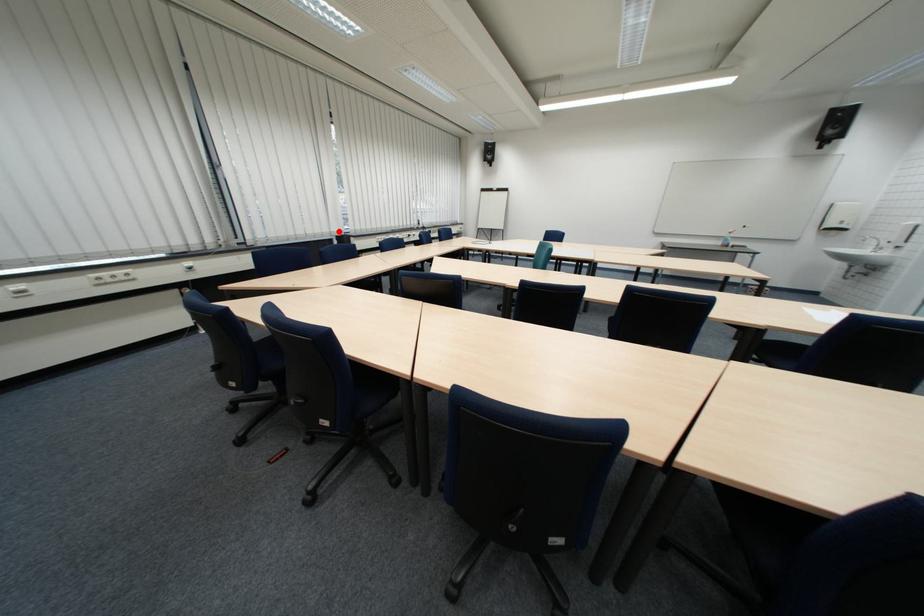
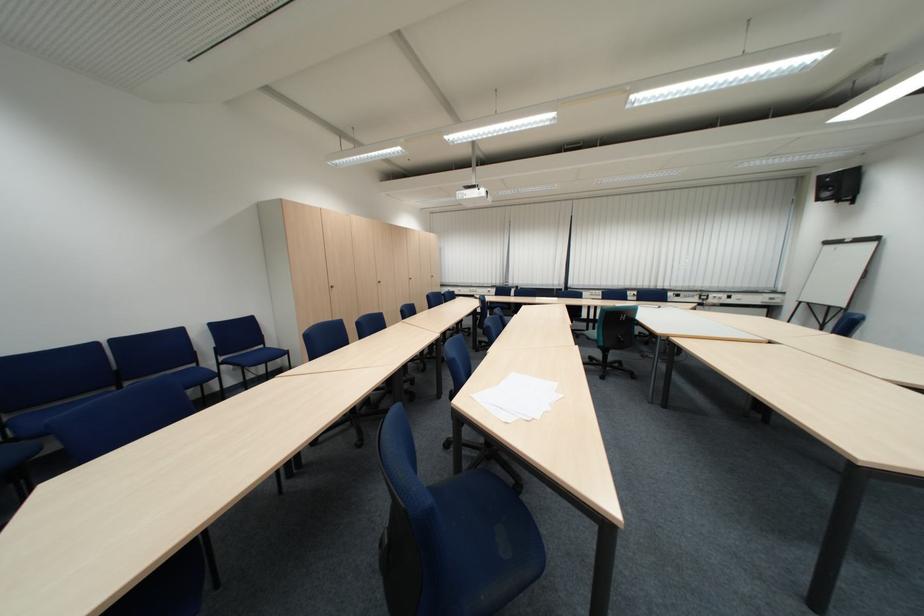
Question: I am providing you with two images of the same scene from different viewpoints. Given a red point in image1, look at the same physical point in image2. Is it:

Choices:
 (A) Closer to the viewpoint
 (B) Farther from the viewpoint

Answer: (B)